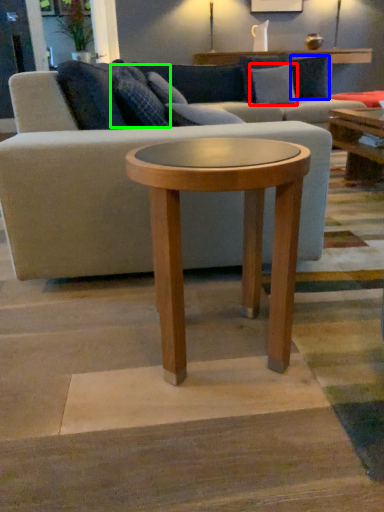
Question: Based on their relative distances, which object is farther from pillow (highlighted by a red box)? Choose from pillow (highlighted by a blue box) and pillow (highlighted by a green box).

Choices:
 (A) pillow
 (B) pillow

Answer: (B)